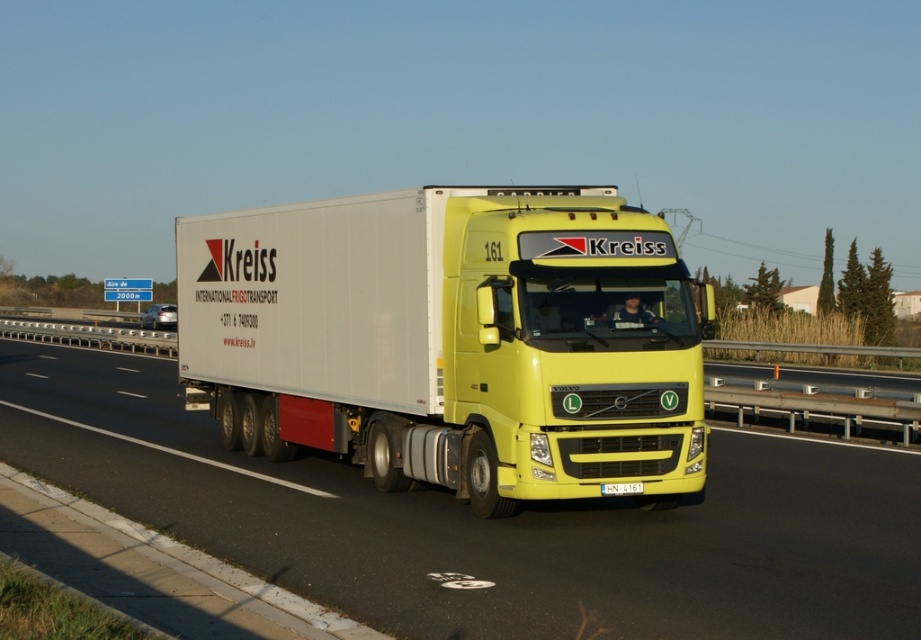
You are a driver approaching the matte white trailer truck at center and the yellow plastic license plate at center on the highway. Which object will you see first as you drive closer?

The matte white trailer truck at center is closer to you than the yellow plastic license plate at center, so you will see the matte white trailer truck at center first as you drive closer.

You are a delivery driver who needs to enter a low clearance tunnel. The tunnel has a height restriction of 4 meters. You see the yellow glossy truck at center and the yellow plastic license plate at center in your vehicle. Based on their sizes, can you estimate if your truck will fit under the tunnel?

The yellow glossy truck at center is much taller than the yellow plastic license plate at center, but without knowing the exact height of the truck, it is impossible to determine if it will fit under the 4 meter clearance tunnel.

You are a traffic officer observing a Volvo semi truck on a highway. You notice two vehicles at the center of the scene. Which one is more to the right, the matte white trailer truck at center or the yellow glossy truck at center?

The matte white trailer truck at center is positioned on the right side of the yellow glossy truck at center, so the matte white trailer truck at center is more to the right.